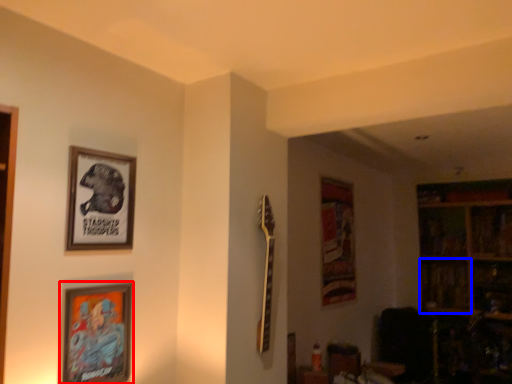
Question: Which of the following is the farthest to the observer, picture frame (highlighted by a red box) or shelf (highlighted by a blue box)?

Choices:
 (A) picture frame
 (B) shelf

Answer: (B)